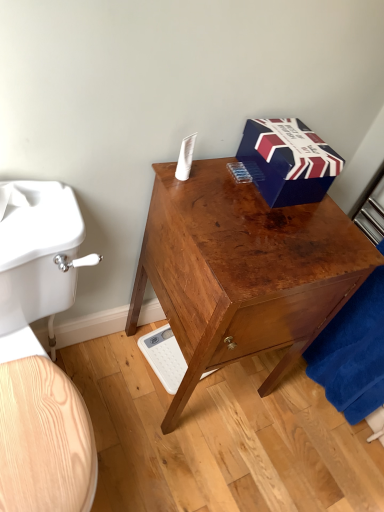
Find the location of a particular element. vacant space to the right of white matte toilet paper at upper center is located at coordinates (240, 197).